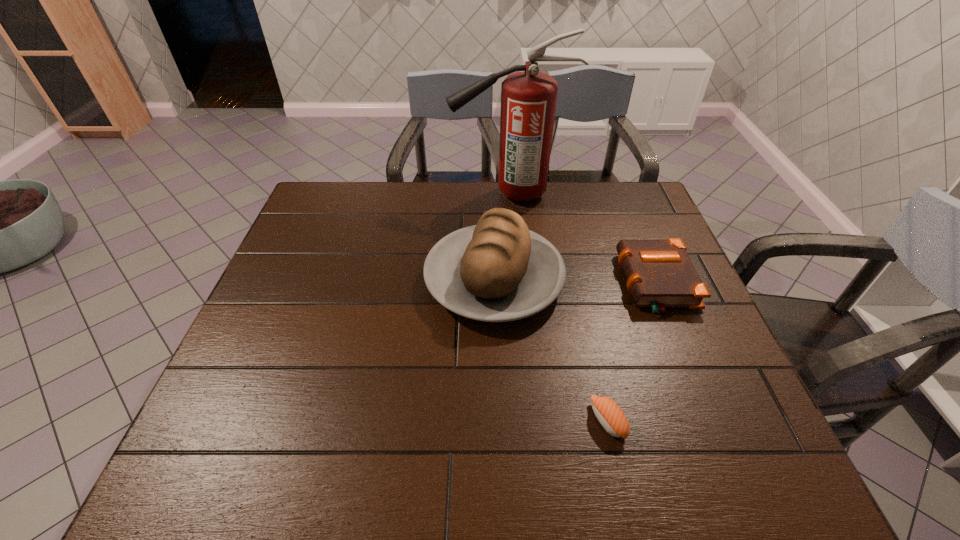
Find the location of a particular element. vacant space located 0.110m on the left of the second tallest object is located at coordinates (385, 280).

You are a GUI agent. You are given a task and a screenshot of the screen. Output one action in this format:
    pyautogui.click(x=<x>, y=<y>)
    Task: Click on the free space located 0.130m on the spine side of the Bible
    
    Given the screenshot: What is the action you would take?
    tap(573, 284)

At what (x,y) coordinates should I click in order to perform the action: click on free spot located 0.130m on the spine side of the Bible. Please return your answer as a coordinate pair (x, y). The width and height of the screenshot is (960, 540). Looking at the image, I should click on (573, 284).

Identify the location of free space located on the spine side of the Bible. (547, 284).

This screenshot has height=540, width=960. In order to click on vacant space located on the left of the sushi in this screenshot , I will do `click(417, 421)`.

Find the location of `object situated at the far edge`. object situated at the far edge is located at coordinates (528, 99).

The image size is (960, 540). I want to click on object located at the near edge, so click(x=611, y=417).

Find the location of a particular element. object that is at the right edge is located at coordinates (659, 273).

Image resolution: width=960 pixels, height=540 pixels. In the image, there is a desktop. Identify the location of blank space at the far edge. click(576, 198).

The image size is (960, 540). Identify the location of vacant space at the near edge of the desktop. coord(308,476).